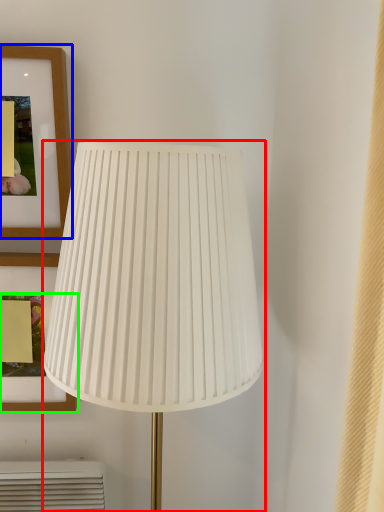
Question: Which object is the closest to the lamp (highlighted by a red box)? Choose among these: picture frame (highlighted by a blue box) or picture frame (highlighted by a green box).

Choices:
 (A) picture frame
 (B) picture frame

Answer: (A)